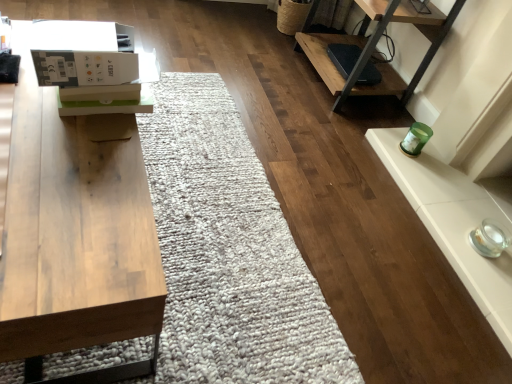
Describe the element at coordinates (92, 66) in the screenshot. I see `white cardboard box at upper left` at that location.

What is the approximate height of white cardboard box at upper left?

The height of white cardboard box at upper left is 4.39 inches.

Where is `white cardboard box at upper left`? white cardboard box at upper left is located at coordinates (92, 66).

The image size is (512, 384). Describe the element at coordinates (75, 237) in the screenshot. I see `wooden table at left` at that location.

Identify the location of wooden table at left. The height and width of the screenshot is (384, 512). (75, 237).

This screenshot has height=384, width=512. Find the location of `white cardboard box at upper left`. white cardboard box at upper left is located at coordinates (92, 66).

In the image, is wooden table at left on the left side or the right side of white cardboard box at upper left?

Clearly, wooden table at left is on the left of white cardboard box at upper left in the image.

Which object is further away from the camera, wooden table at left or white cardboard box at upper left?

white cardboard box at upper left is further from the camera.

Does point (65, 147) lie in front of point (65, 77)?

No, (65, 147) is further to viewer.

From the image's perspective, between wooden table at left and white cardboard box at upper left, who is located below?

wooden table at left is shown below in the image.

From a real-world perspective, does wooden table at left stand above white cardboard box at upper left?

Incorrect, from a real-world perspective, wooden table at left is lower than white cardboard box at upper left.

From the picture: Considering the relative sizes of wooden table at left and white cardboard box at upper left in the image provided, is wooden table at left wider than white cardboard box at upper left?

Yes, wooden table at left is wider than white cardboard box at upper left.

Looking at this image, is wooden table at left taller than white cardboard box at upper left?

Yes.

Is wooden table at left bigger or smaller than white cardboard box at upper left?

In the image, wooden table at left appears to be larger than white cardboard box at upper left.

Is wooden table at left inside or outside of white cardboard box at upper left?

wooden table at left is not inside white cardboard box at upper left, it's outside.

Is wooden table at left directly adjacent to white cardboard box at upper left?

wooden table at left and white cardboard box at upper left are not in contact.

Looking at this image, is wooden table at left looking in the opposite direction of white cardboard box at upper left?

No, wooden table at left is not facing the opposite direction of white cardboard box at upper left.

You are a GUI agent. You are given a task and a screenshot of the screen. Output one action in this format:
    pyautogui.click(x=<x>, y=<y>)
    Task: Click on the table lying on the left of white cardboard box at upper left
    The width and height of the screenshot is (512, 384).
    Given the screenshot: What is the action you would take?
    pyautogui.click(x=75, y=237)

Is white cardboard box at upper left to the left of wooden table at left from the viewer's perspective?

In fact, white cardboard box at upper left is to the right of wooden table at left.

In the image, is white cardboard box at upper left positioned in front of or behind wooden table at left?

white cardboard box at upper left is positioned farther from the viewer than wooden table at left.

Considering the points (133, 73) and (135, 332), which point is behind, point (133, 73) or point (135, 332)?

The point (133, 73) is farther.

From the image's perspective, which is below, white cardboard box at upper left or wooden table at left?

From the image's view, wooden table at left is below.

From a real-world perspective, is white cardboard box at upper left physically located above or below wooden table at left?

Clearly, from a real-world perspective, white cardboard box at upper left is above wooden table at left.

Can you confirm if white cardboard box at upper left is thinner than wooden table at left?

Indeed, white cardboard box at upper left has a lesser width compared to wooden table at left.

From their relative heights in the image, would you say white cardboard box at upper left is taller or shorter than wooden table at left?

white cardboard box at upper left is shorter than wooden table at left.

Based on their sizes in the image, would you say white cardboard box at upper left is bigger or smaller than wooden table at left?

white cardboard box at upper left is smaller than wooden table at left.

From the picture: Can wooden table at left be found inside white cardboard box at upper left?

No, white cardboard box at upper left does not contain wooden table at left.

Are white cardboard box at upper left and wooden table at left far apart?

No, white cardboard box at upper left is not far from wooden table at left.

Is white cardboard box at upper left facing away from wooden table at left?

No, white cardboard box at upper left is not facing the opposite direction of wooden table at left.

How many degrees apart are the facing directions of white cardboard box at upper left and wooden table at left?

1.18 degrees separate the facing orientations of white cardboard box at upper left and wooden table at left.

Find the location of a particular element. table on the left of the white cardboard box at upper left is located at coordinates (75, 237).

Locate an element on the screen. cardboard box to the right of wooden table at left is located at coordinates (92, 66).

Find the location of `cardboard box that appears above the wooden table at left (from the image's perspective)`. cardboard box that appears above the wooden table at left (from the image's perspective) is located at coordinates (92, 66).